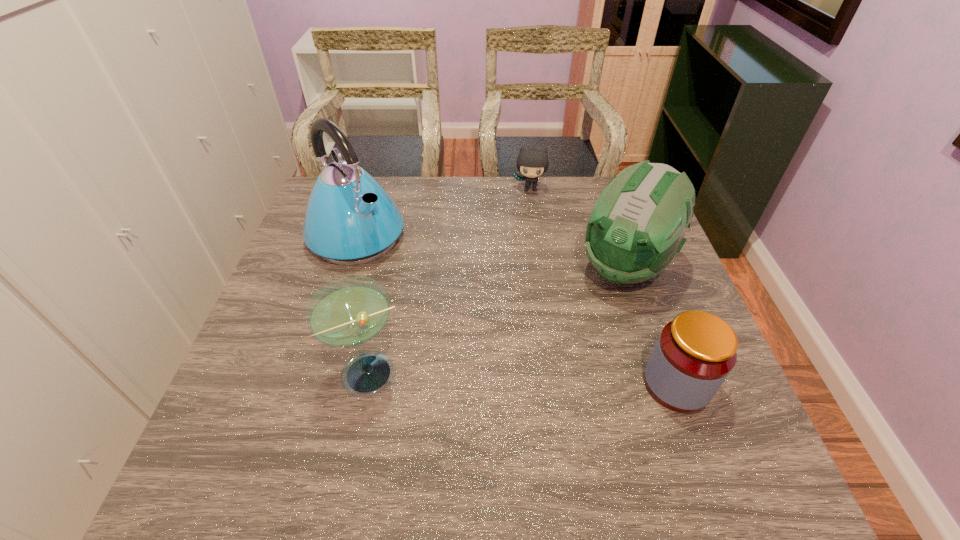
The image size is (960, 540). In order to click on jar positioned at the near edge in this screenshot , I will do `click(694, 354)`.

The width and height of the screenshot is (960, 540). In order to click on object that is at the left edge in this screenshot , I will do `click(350, 219)`.

This screenshot has width=960, height=540. I want to click on jar that is at the right edge, so click(694, 354).

Identify the location of football helmet that is positioned at the right edge. The width and height of the screenshot is (960, 540). (637, 226).

Locate an element on the screen. The height and width of the screenshot is (540, 960). object positioned at the far left corner is located at coordinates (350, 219).

Locate an element on the screen. The height and width of the screenshot is (540, 960). object at the near right corner is located at coordinates (694, 354).

In the image, there is a desktop. What are the coordinates of `free space at the far edge` in the screenshot? It's located at (449, 218).

In the image, there is a desktop. Find the location of `vacant space at the near edge`. vacant space at the near edge is located at coordinates (554, 413).

You are a GUI agent. You are given a task and a screenshot of the screen. Output one action in this format:
    pyautogui.click(x=<x>, y=<y>)
    Task: Click on the vacant space at the left edge of the desktop
    This screenshot has height=540, width=960.
    Given the screenshot: What is the action you would take?
    pyautogui.click(x=330, y=281)

Where is `free space at the right edge of the desktop`? This screenshot has width=960, height=540. free space at the right edge of the desktop is located at coordinates (667, 310).